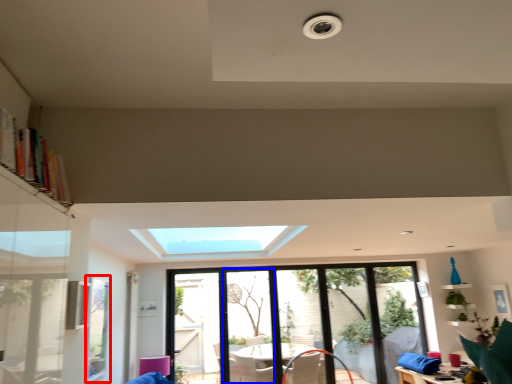
Question: Which object appears closest to the camera in this image, window screen (highlighted by a red box) or screen door (highlighted by a blue box)?

Choices:
 (A) window screen
 (B) screen door

Answer: (A)